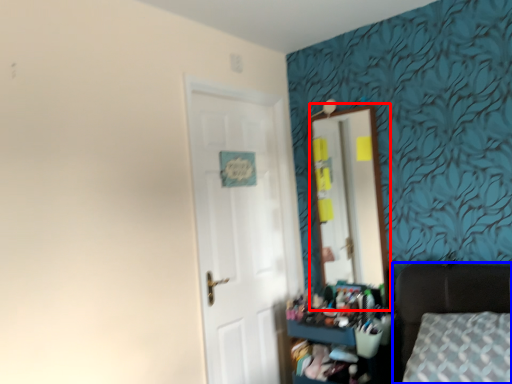
Question: Which object appears farthest to the camera in this image, mirror (highlighted by a red box) or furniture (highlighted by a blue box)?

Choices:
 (A) mirror
 (B) furniture

Answer: (A)